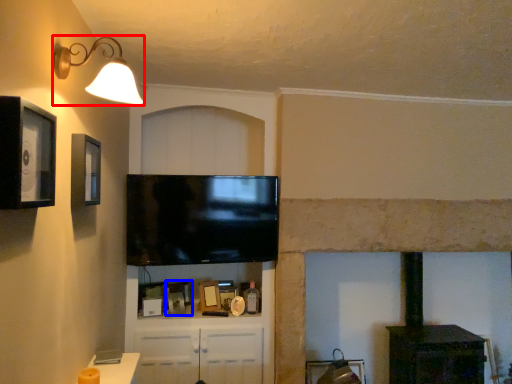
Question: Which object is further to the camera taking this photo, light fixture (highlighted by a red box) or picture frame (highlighted by a blue box)?

Choices:
 (A) light fixture
 (B) picture frame

Answer: (B)